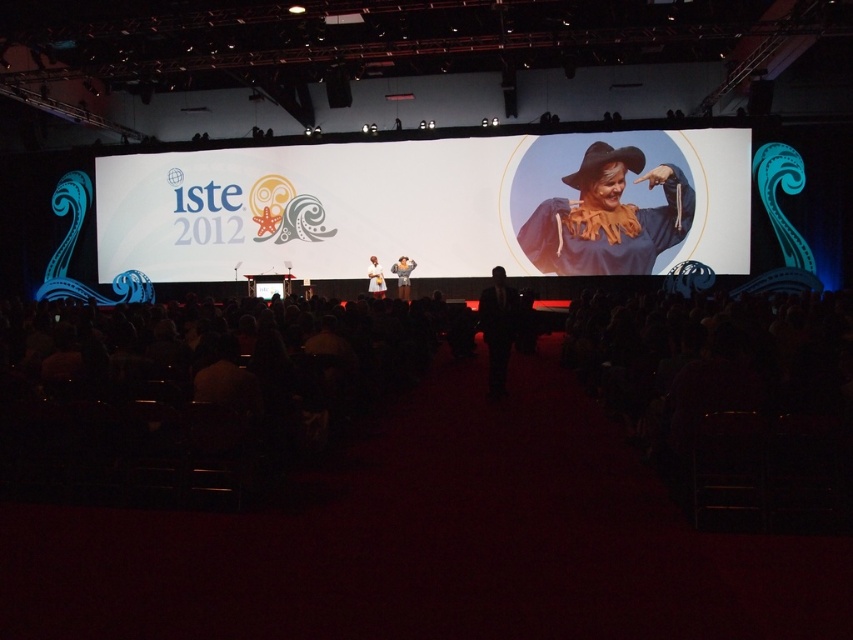
Question: Which point is closer to the camera?

Choices:
 (A) matte black suit at center
 (B) white paper at center
 (C) white fabric at center
 (D) black suit at center

Answer: (D)

Question: Which point is closer to the camera taking this photo?

Choices:
 (A) (546, 225)
 (B) (374, 259)
 (C) (798, 392)

Answer: (C)

Question: Does black suit at center have a smaller size compared to white fabric at center?

Choices:
 (A) yes
 (B) no

Answer: (A)

Question: Is black plastic chairs at center in front of white fabric at center?

Choices:
 (A) yes
 (B) no

Answer: (A)

Question: Among these points, which one is nearest to the camera?

Choices:
 (A) (410, 262)
 (B) (596, 141)

Answer: (B)

Question: Is black plastic chairs at center to the right of white paper at center from the viewer's perspective?

Choices:
 (A) yes
 (B) no

Answer: (A)